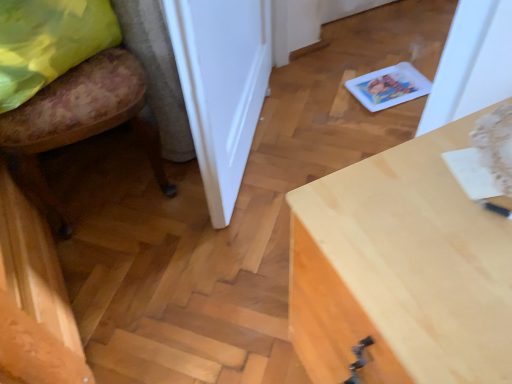
You are a GUI agent. You are given a task and a screenshot of the screen. Output one action in this format:
    pyautogui.click(x=<x>, y=<y>)
    Task: Click on the vacant area situated below floral fabric chair at lower left (from a real-world perspective)
    This screenshot has width=512, height=384.
    Given the screenshot: What is the action you would take?
    pyautogui.click(x=101, y=177)